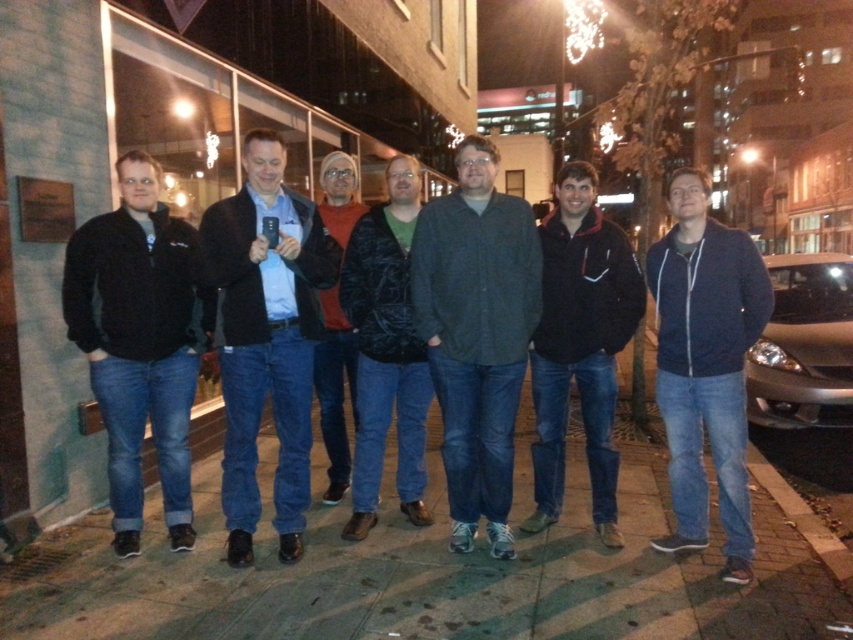
Does point (740, 408) lie behind point (581, 230)?

No.

Where is `dark blue zip-up jacket at center`? This screenshot has width=853, height=640. dark blue zip-up jacket at center is located at coordinates (705, 365).

Is dark green textured jacket at center to the right of dark gray textured jacket at center from the viewer's perspective?

Indeed, dark green textured jacket at center is positioned on the right side of dark gray textured jacket at center.

Is dark green textured jacket at center positioned before dark gray textured jacket at center?

That is False.

Is point (398, 307) behind point (355, 364)?

No, it is in front of (355, 364).

The image size is (853, 640). I want to click on dark green textured jacket at center, so click(386, 349).

Between point (126, 164) and point (532, 307), which one is positioned behind?

The point (532, 307) is more distant.

Between point (96, 326) and point (476, 173), which one is positioned behind?

Point (96, 326)

The image size is (853, 640). I want to click on black fleece jacket at left, so click(140, 342).